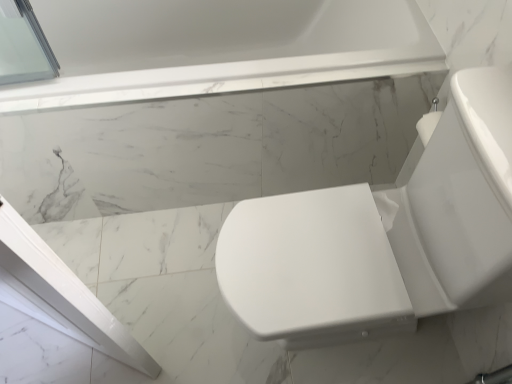
Locate an element on the screen. vacant space situated on the left part of white glossy toilet at right is located at coordinates (174, 286).